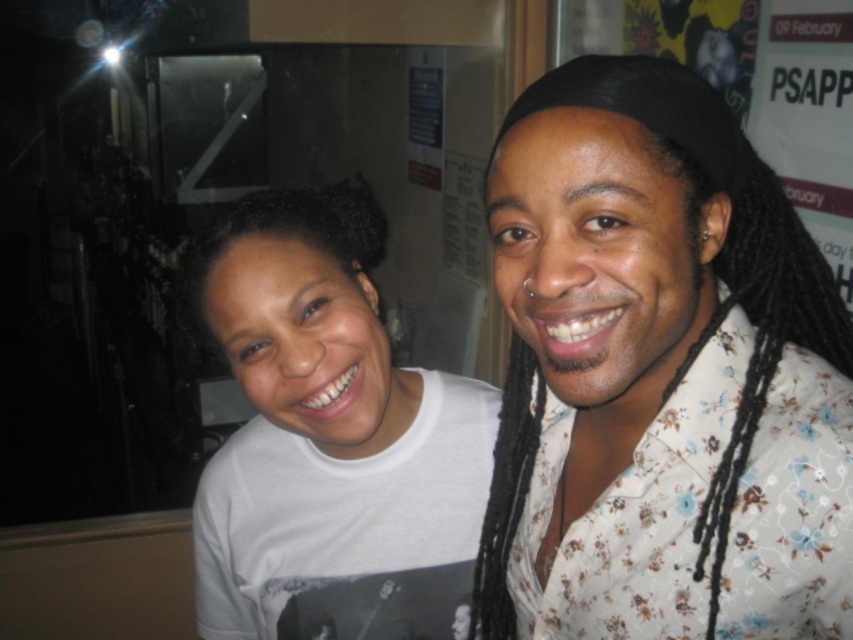
Who is lower down, floral print shirt at right or white matte t-shirt at center?

white matte t-shirt at center is below.

Is floral print shirt at right further to camera compared to white matte t-shirt at center?

No, floral print shirt at right is in front of white matte t-shirt at center.

Find the location of a particular element. The image size is (853, 640). floral print shirt at right is located at coordinates 660,376.

Who is higher up, floral print shirt at right or black curly hair at upper left?

Positioned higher is black curly hair at upper left.

Is floral print shirt at right bigger than black curly hair at upper left?

Yes, floral print shirt at right is bigger than black curly hair at upper left.

What do you see at coordinates (660, 376) in the screenshot?
I see `floral print shirt at right` at bounding box center [660, 376].

Identify the location of floral print shirt at right. This screenshot has width=853, height=640. point(660,376).

Does white matte t-shirt at center have a larger size compared to black curly hair at upper left?

Yes.

Who is taller, white matte t-shirt at center or black curly hair at upper left?

Standing taller between the two is white matte t-shirt at center.

Where is `white matte t-shirt at center`? The width and height of the screenshot is (853, 640). white matte t-shirt at center is located at coordinates (328, 436).

At what (x,y) coordinates should I click in order to perform the action: click on white matte t-shirt at center. Please return your answer as a coordinate pair (x, y). This screenshot has height=640, width=853. Looking at the image, I should click on (328, 436).